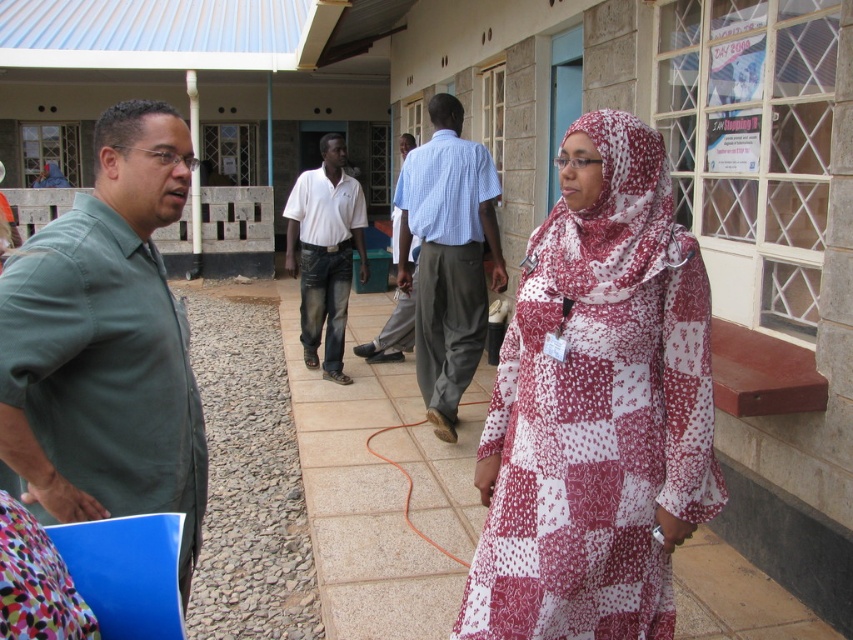
Question: Among these objects, which one is farthest from the camera?

Choices:
 (A) white and red patterned dress at center
 (B) light blue checkered shirt at center
 (C) white cotton shirt at center

Answer: (C)

Question: Does white and red patterned dress at center have a larger size compared to light blue striped shirt at center?

Choices:
 (A) yes
 (B) no

Answer: (B)

Question: Which of the following is the closest to the observer?

Choices:
 (A) tap(653, 131)
 (B) tap(315, 252)
 (C) tap(93, 513)

Answer: (C)

Question: Does white and red patterned dress at center have a smaller size compared to light blue checkered shirt at center?

Choices:
 (A) yes
 (B) no

Answer: (A)

Question: Which point appears farthest from the camera in this image?

Choices:
 (A) (410, 241)
 (B) (426, 220)

Answer: (A)

Question: Can you confirm if light blue checkered shirt at center is smaller than light blue striped shirt at center?

Choices:
 (A) no
 (B) yes

Answer: (B)